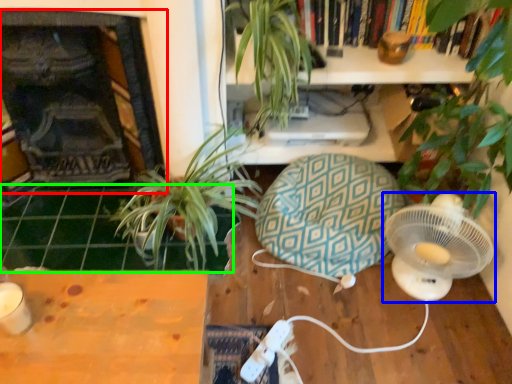
Question: Which object is positioned farthest from fireplace (highlighted by a red box)? Select from mechanical fan (highlighted by a blue box) and tile (highlighted by a green box).

Choices:
 (A) mechanical fan
 (B) tile

Answer: (A)